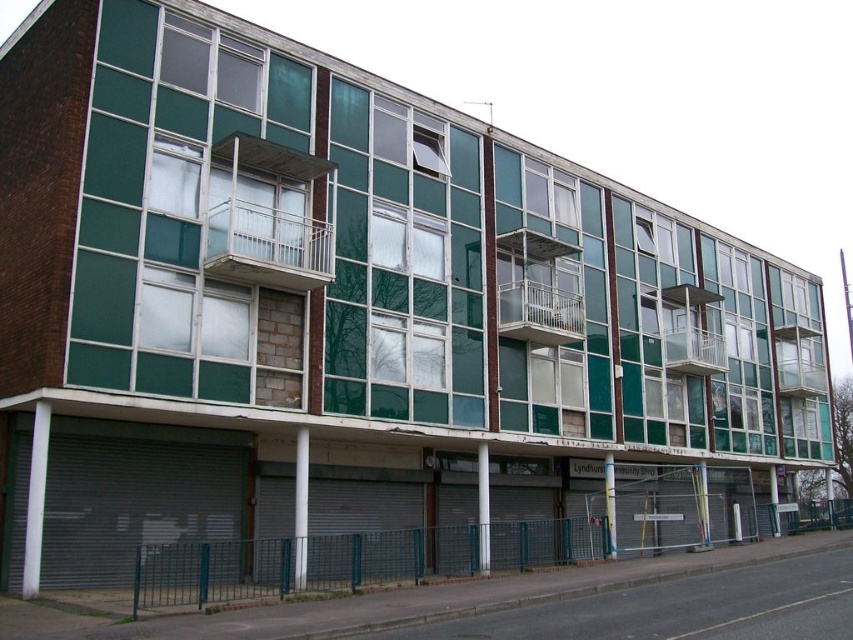
Can you confirm if white metal balcony at center is positioned below clear glass balcony at upper right?

Incorrect, white metal balcony at center is not positioned below clear glass balcony at upper right.

Between white metal balcony at center and clear glass balcony at upper right, which one has more height?

white metal balcony at center

Between point (569, 342) and point (778, 364), which one is positioned behind?

Point (778, 364)

The image size is (853, 640). What are the coordinates of `white metal balcony at center` in the screenshot? It's located at (x=538, y=289).

Is metallic silver balcony at upper right bigger than clear glass balcony at upper right?

Actually, metallic silver balcony at upper right might be smaller than clear glass balcony at upper right.

Who is higher up, metallic silver balcony at upper right or clear glass balcony at upper right?

metallic silver balcony at upper right

Does point (683, 314) lie in front of point (776, 372)?

Yes.

The image size is (853, 640). I want to click on metallic silver balcony at upper right, so click(x=689, y=332).

Is white metal balcony at upper center taller than metallic silver balcony at upper right?

Indeed, white metal balcony at upper center has a greater height compared to metallic silver balcony at upper right.

Is white metal balcony at upper center below metallic silver balcony at upper right?

Incorrect, white metal balcony at upper center is not positioned below metallic silver balcony at upper right.

Does point (329, 241) come in front of point (679, 339)?

Yes, point (329, 241) is closer to viewer.

At what (x,y) coordinates should I click in order to perform the action: click on white metal balcony at upper center. Please return your answer as a coordinate pair (x, y). The width and height of the screenshot is (853, 640). Looking at the image, I should click on (270, 221).